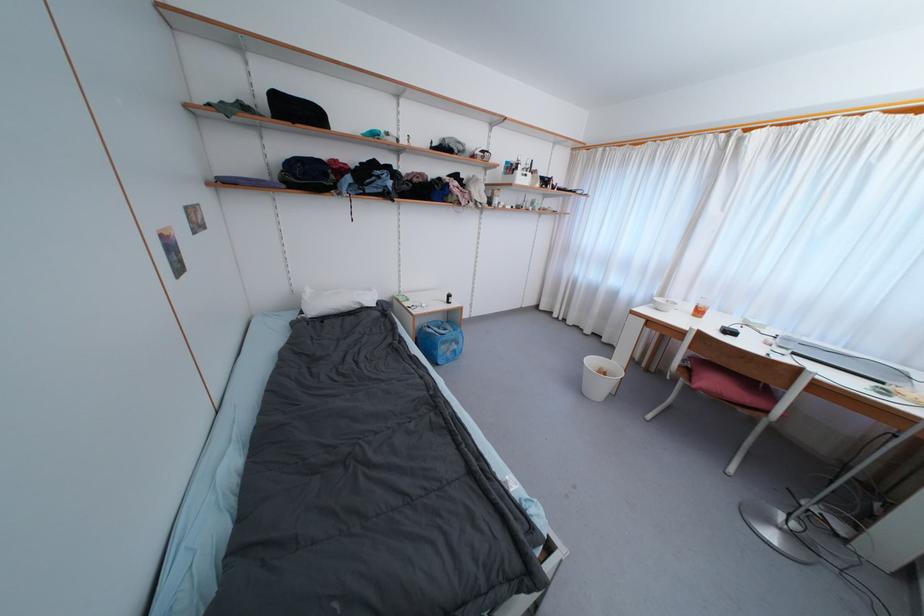
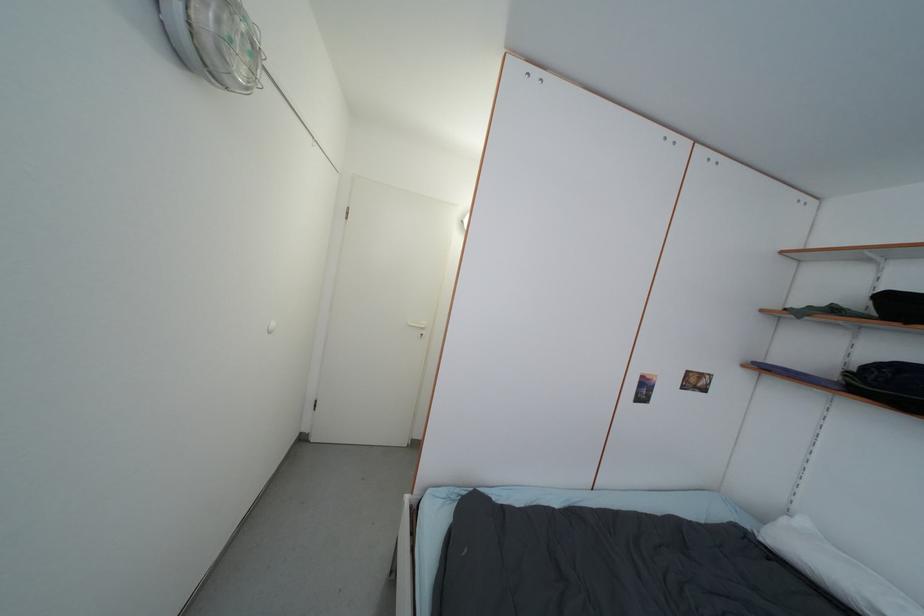
In the second image, find the point that corresponds to point 337,314 in the first image.

(812, 576)